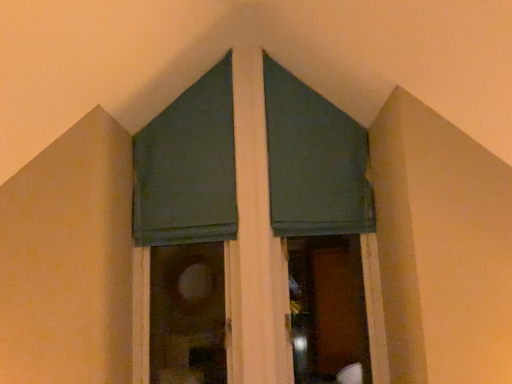
Locate an element on the screen. The width and height of the screenshot is (512, 384). green fabric window screen at upper center is located at coordinates (188, 167).

Describe the element at coordinates (188, 167) in the screenshot. I see `green fabric window screen at upper center` at that location.

In order to face green fabric window screen at upper center, should I rotate leftwards or rightwards?

Rotate your view left by about 9.683°.

The width and height of the screenshot is (512, 384). What do you see at coordinates (256, 231) in the screenshot?
I see `green fabric at center` at bounding box center [256, 231].

Locate an element on the screen. The image size is (512, 384). green fabric at center is located at coordinates (256, 231).

This screenshot has height=384, width=512. I want to click on green fabric window screen at upper center, so click(x=188, y=167).

Is green fabric window screen at upper center at the right side of green fabric at center?

Incorrect, green fabric window screen at upper center is not on the right side of green fabric at center.

Does green fabric window screen at upper center come in front of green fabric at center?

No, green fabric window screen at upper center is further to the viewer.

Is point (147, 172) positioned before point (225, 242)?

No, (147, 172) is behind (225, 242).

In the scene shown: From the image's perspective, does green fabric window screen at upper center appear higher than green fabric at center?

Yes, from the image's perspective, green fabric window screen at upper center is over green fabric at center.

Based on the photo, from a real-world perspective, relative to green fabric at center, is green fabric window screen at upper center vertically above or below?

Clearly, from a real-world perspective, green fabric window screen at upper center is above green fabric at center.

Considering the sizes of objects green fabric window screen at upper center and green fabric at center in the image provided, who is thinner, green fabric window screen at upper center or green fabric at center?

green fabric window screen at upper center is thinner.

Is green fabric window screen at upper center taller or shorter than green fabric at center?

green fabric window screen at upper center is shorter than green fabric at center.

Who is smaller, green fabric window screen at upper center or green fabric at center?

green fabric window screen at upper center is smaller.

Is green fabric window screen at upper center inside the boundaries of green fabric at center, or outside?

green fabric window screen at upper center is located inside green fabric at center.

Is green fabric window screen at upper center far from green fabric at center?

That's not correct — green fabric window screen at upper center is a little close to green fabric at center.

Is green fabric window screen at upper center turned away from green fabric at center?

Correct, green fabric window screen at upper center is looking away from green fabric at center.

How distant is green fabric window screen at upper center from green fabric at center?

A distance of 3.46 inches exists between green fabric window screen at upper center and green fabric at center.

Identify the location of window screen that appears on the left of green fabric at center. (188, 167).

Which object is positioned more to the left, green fabric at center or green fabric window screen at upper center?

From the viewer's perspective, green fabric window screen at upper center appears more on the left side.

Does green fabric at center come in front of green fabric window screen at upper center?

That is True.

Between point (266, 382) and point (178, 222), which one is positioned behind?

The point (178, 222) is farther from the camera.

Consider the image. From the image's perspective, which one is positioned higher, green fabric at center or green fabric window screen at upper center?

From the image's view, green fabric window screen at upper center is above.

From a real-world perspective, does green fabric at center stand above green fabric window screen at upper center?

No, from a real-world perspective, green fabric at center is not over green fabric window screen at upper center

Can you confirm if green fabric at center is thinner than green fabric window screen at upper center?

In fact, green fabric at center might be wider than green fabric window screen at upper center.

In terms of height, does green fabric at center look taller or shorter compared to green fabric window screen at upper center?

In the image, green fabric at center appears to be taller than green fabric window screen at upper center.

Who is bigger, green fabric at center or green fabric window screen at upper center?

green fabric at center.

Consider the image. Could green fabric window screen at upper center be considered to be inside green fabric at center?

Indeed, green fabric window screen at upper center is located within green fabric at center.

Are green fabric at center and green fabric window screen at upper center far apart?

No.

Is green fabric at center looking in the opposite direction of green fabric window screen at upper center?

That's right, green fabric at center is facing away from green fabric window screen at upper center.

What's the angular difference between green fabric at center and green fabric window screen at upper center's facing directions?

1.05 degrees separate the facing orientations of green fabric at center and green fabric window screen at upper center.

Measure the distance between green fabric at center and green fabric window screen at upper center.

green fabric at center is 3.46 inches away from green fabric window screen at upper center.

You are a GUI agent. You are given a task and a screenshot of the screen. Output one action in this format:
    pyautogui.click(x=<x>, y=<y>)
    Task: Click on the window screen above the green fabric at center (from a real-world perspective)
    This screenshot has height=384, width=512.
    Given the screenshot: What is the action you would take?
    pyautogui.click(x=188, y=167)

Find the location of a particular element. window screen behind the green fabric at center is located at coordinates (188, 167).

There is a green fabric at center. Where is `window screen above it (from a real-world perspective)`? This screenshot has width=512, height=384. window screen above it (from a real-world perspective) is located at coordinates (188, 167).